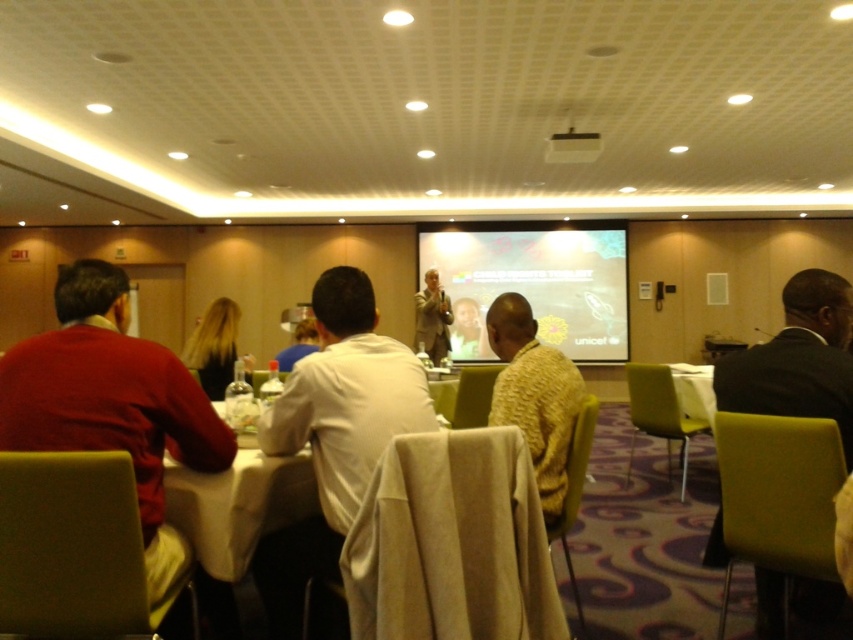
Question: From the image, what is the correct spatial relationship of white matte shirt at center in relation to matte white shirt at center?

Choices:
 (A) below
 (B) above

Answer: (A)

Question: Can you confirm if matte projector screen at center is positioned above matte white shirt at center?

Choices:
 (A) no
 (B) yes

Answer: (B)

Question: Among these objects, which one is nearest to the camera?

Choices:
 (A) white plastic projector at upper center
 (B) yellow knitted sweater at center
 (C) matte red shirt at left
 (D) black suit at right

Answer: (C)

Question: Can you confirm if black suit at right is positioned below white plastic projector at upper center?

Choices:
 (A) no
 (B) yes

Answer: (B)

Question: Estimate the real-world distances between objects in this image. Which object is farther from the white plastic projector at upper center?

Choices:
 (A) black suit at right
 (B) matte white shirt at center
 (C) white matte shirt at center
 (D) yellow knitted sweater at center

Answer: (C)

Question: Which point is farther to the camera?

Choices:
 (A) (445, 330)
 (B) (86, 333)
 (C) (564, 152)
 (D) (766, 346)

Answer: (A)